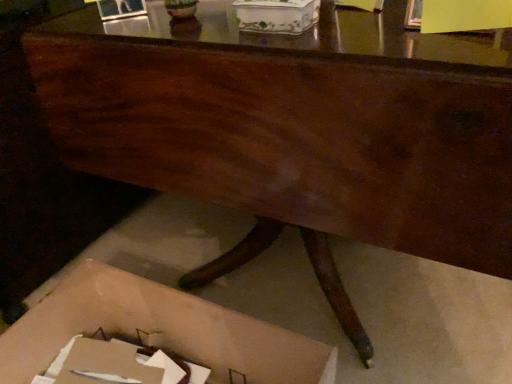
Locate an element on the screen. This screenshot has height=384, width=512. free space to the right of porcelain floral box at center, positioned as the second storage box in bottom-to-top order is located at coordinates (366, 29).